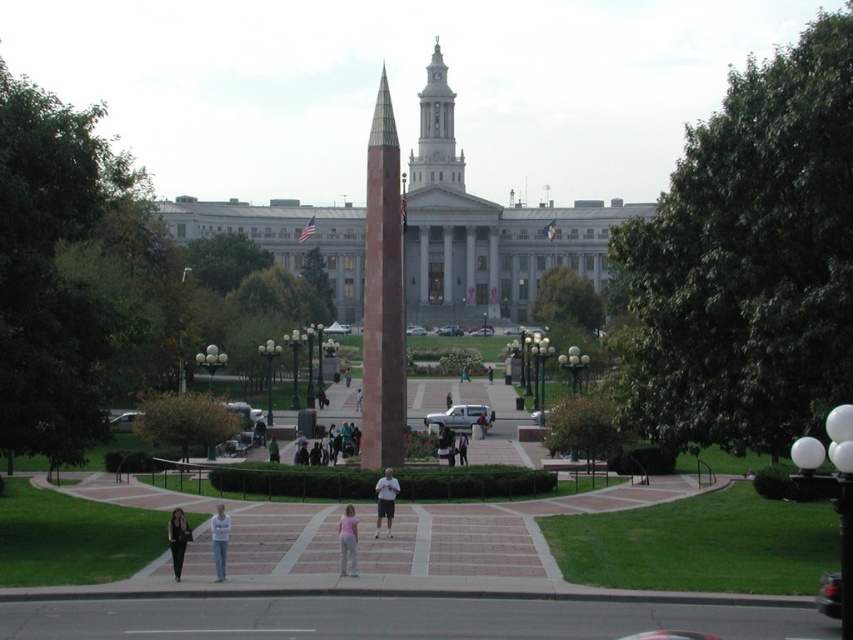
Which is behind, point (393, 353) or point (341, 528)?

Point (393, 353)

In the scene shown: Can you confirm if brown polished stone obelisk at center is thinner than pink fabric pants at center?

No, brown polished stone obelisk at center is not thinner than pink fabric pants at center.

Is point (390, 218) less distant than point (339, 566)?

No, (390, 218) is further to viewer.

The height and width of the screenshot is (640, 853). Find the location of `brown polished stone obelisk at center`. brown polished stone obelisk at center is located at coordinates (381, 294).

Who is taller, brown polished stone obelisk at center or green fabric jacket at center?

brown polished stone obelisk at center is taller.

Between point (381, 160) and point (273, 436), which one is positioned in front?

Point (381, 160)

Where is `brown polished stone obelisk at center`? Image resolution: width=853 pixels, height=640 pixels. brown polished stone obelisk at center is located at coordinates (381, 294).

Is pink fabric pants at center below light blue jeans at center?

Correct, pink fabric pants at center is located below light blue jeans at center.

Is pink fabric pants at center thinner than light blue jeans at center?

Incorrect, pink fabric pants at center's width is not less than light blue jeans at center's.

I want to click on pink fabric pants at center, so click(347, 541).